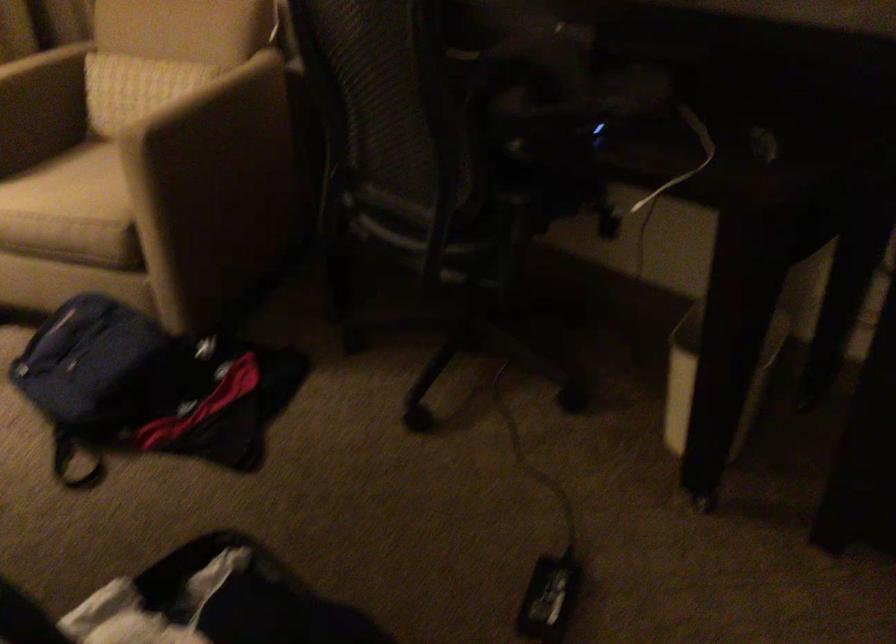
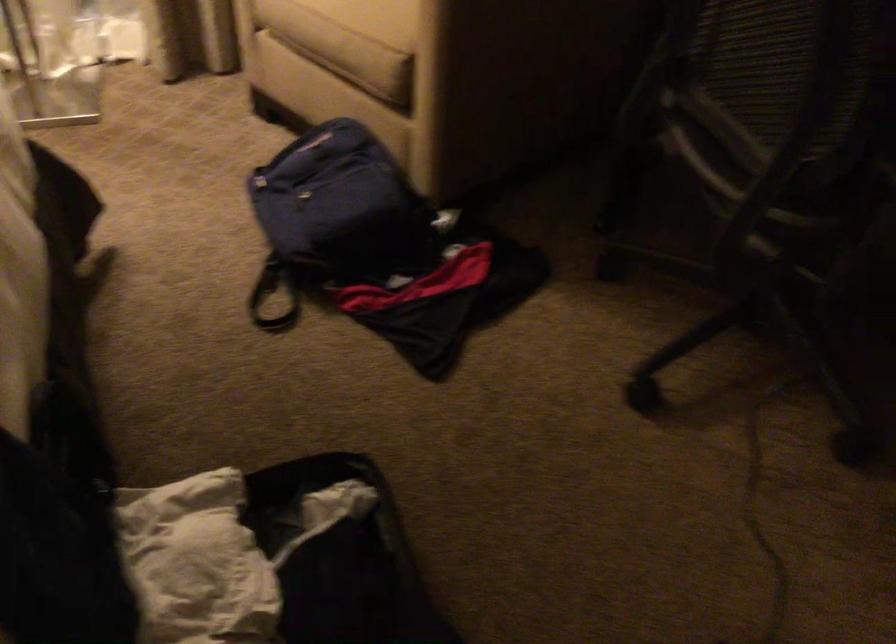
Locate, in the second image, the point that corresponds to point (71, 238) in the first image.

(347, 53)